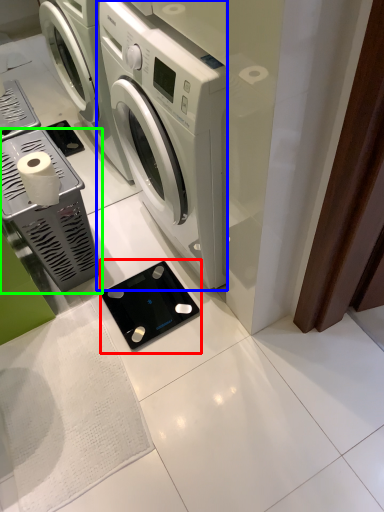
Question: Which object is the closest to the appliance (highlighted by a red box)? Choose among these: washing machine (highlighted by a blue box) or appliance (highlighted by a green box).

Choices:
 (A) washing machine
 (B) appliance

Answer: (B)